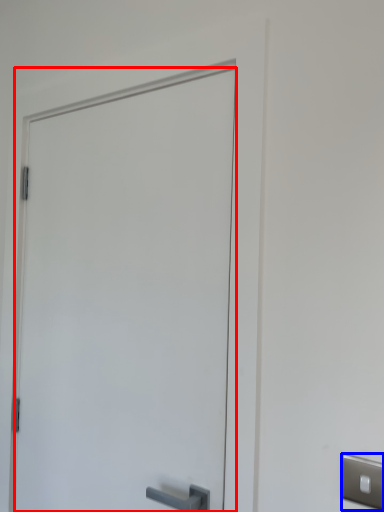
Question: Among these objects, which one is farthest to the camera, door (highlighted by a red box) or light switch (highlighted by a blue box)?

Choices:
 (A) door
 (B) light switch

Answer: (A)